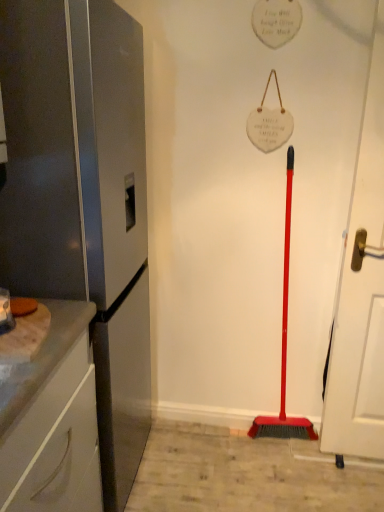
Measure the distance between point [42,434] and camera.

The depth of point [42,434] is 37.60 inches.

Image resolution: width=384 pixels, height=512 pixels. What are the coordinates of `satin silver refrigerator at left` in the screenshot? It's located at point(82,198).

Does white matte door at right have a lesser height compared to white glossy cabinet at left?

No, white matte door at right is not shorter than white glossy cabinet at left.

Between white matte door at right and white glossy cabinet at left, which one has smaller width?

white matte door at right.

Who is more distant, white matte door at right or white glossy cabinet at left?

white matte door at right is behind.

From the picture: Can you confirm if white matte door at right is smaller than white glossy cabinet at left?

Yes, white matte door at right is smaller than white glossy cabinet at left.

Which of these two, satin silver refrigerator at left or white glossy cabinet at left, is smaller?

With smaller size is white glossy cabinet at left.

Is satin silver refrigerator at left positioned far away from white glossy cabinet at left?

No, there isn't a large distance between satin silver refrigerator at left and white glossy cabinet at left.

Is point (66, 80) more distant than point (61, 378)?

Yes, it is.

This screenshot has height=512, width=384. What are the coordinates of `door above the satin silver refrigerator at left (from a real-world perspective)` in the screenshot? It's located at (361, 291).

From the image's perspective, would you say white matte door at right is positioned over satin silver refrigerator at left?

Correct, white matte door at right appears higher than satin silver refrigerator at left in the image.

Choose the correct answer: Is white matte door at right inside satin silver refrigerator at left or outside it?

white matte door at right cannot be found inside satin silver refrigerator at left.

How many degrees apart are the facing directions of white matte door at right and satin silver refrigerator at left?

There is a 92.1-degree angle between the facing directions of white matte door at right and satin silver refrigerator at left.

What's the angular difference between satin silver refrigerator at left and white matte door at right's facing directions?

There is a 92.1-degree angle between the facing directions of satin silver refrigerator at left and white matte door at right.

Is satin silver refrigerator at left facing away from white matte door at right?

satin silver refrigerator at left does not have its back to white matte door at right.

Measure the distance between satin silver refrigerator at left and white matte door at right.

Result: They are 37.29 inches apart.

From the picture: From their relative heights in the image, would you say satin silver refrigerator at left is taller or shorter than white matte door at right?

satin silver refrigerator at left is shorter than white matte door at right.

From the image's perspective, who appears lower, white glossy cabinet at left or satin silver refrigerator at left?

white glossy cabinet at left.

Consider the image. In terms of height, does white glossy cabinet at left look taller or shorter compared to satin silver refrigerator at left?

In the image, white glossy cabinet at left appears to be shorter than satin silver refrigerator at left.

What are the coordinates of `cabinetry in front of the satin silver refrigerator at left` in the screenshot? It's located at [x=51, y=419].

Is white glossy cabinet at left oriented away from satin silver refrigerator at left?

No, satin silver refrigerator at left is not at the back of white glossy cabinet at left.

Can you tell me how much white glossy cabinet at left and white matte door at right differ in facing direction?

92.3 degrees separate the facing orientations of white glossy cabinet at left and white matte door at right.

From the picture: Is white glossy cabinet at left facing away from white matte door at right?

white glossy cabinet at left is not turned away from white matte door at right.

Based on the photo, from a real-world perspective, which is physically below, white glossy cabinet at left or white matte door at right?

white glossy cabinet at left.

Which object is positioned more to the left, white glossy cabinet at left or white matte door at right?

white glossy cabinet at left.

You are a GUI agent. You are given a task and a screenshot of the screen. Output one action in this format:
    pyautogui.click(x=<x>, y=<y>)
    Task: Click on the cabinetry that is below the white matte door at right (from the image's perspective)
    This screenshot has height=512, width=384.
    Given the screenshot: What is the action you would take?
    pyautogui.click(x=51, y=419)

Locate an element on the screen. The image size is (384, 512). appliance located above the white glossy cabinet at left (from the image's perspective) is located at coordinates (82, 198).

Which object lies nearer to the anchor point white glossy cabinet at left, white matte door at right or satin silver refrigerator at left?

Based on the image, satin silver refrigerator at left appears to be nearer to white glossy cabinet at left.

Estimate the real-world distances between objects in this image. Which object is closer to white glossy cabinet at left, satin silver refrigerator at left or white matte door at right?

satin silver refrigerator at left lies closer to white glossy cabinet at left than the other object.

Which object lies nearer to the anchor point satin silver refrigerator at left, white matte door at right or white glossy cabinet at left?

white glossy cabinet at left is positioned closer to the anchor satin silver refrigerator at left.

From the image, which object appears to be nearer to white matte door at right, satin silver refrigerator at left or white glossy cabinet at left?

satin silver refrigerator at left lies closer to white matte door at right than the other object.

When comparing their distances from white matte door at right, does white glossy cabinet at left or satin silver refrigerator at left seem closer?

The object closer to white matte door at right is satin silver refrigerator at left.

Considering their positions, is white glossy cabinet at left positioned closer to satin silver refrigerator at left than white matte door at right?

The object closer to satin silver refrigerator at left is white glossy cabinet at left.

Where is `appliance between white glossy cabinet at left and white matte door at right from left to right`? The image size is (384, 512). appliance between white glossy cabinet at left and white matte door at right from left to right is located at coordinates (82, 198).